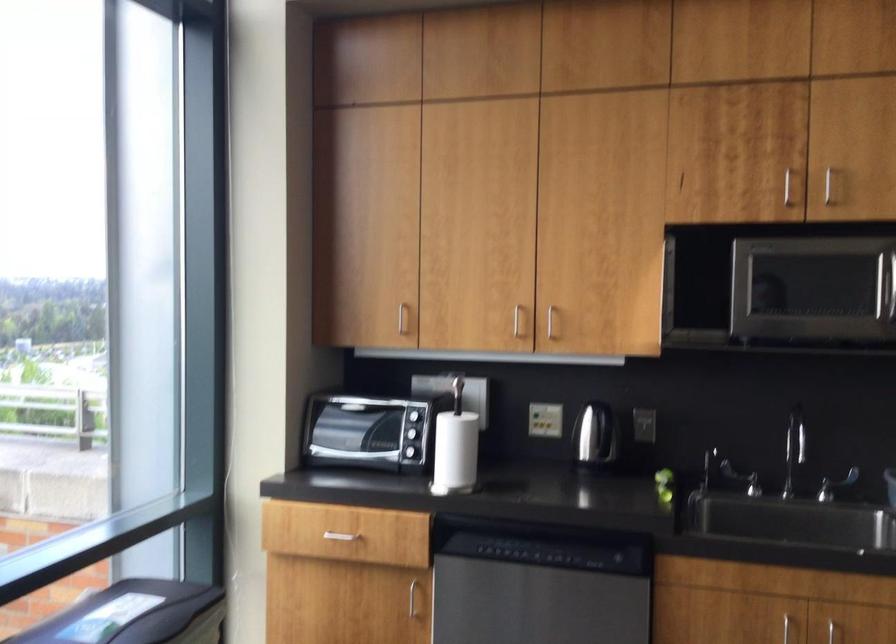
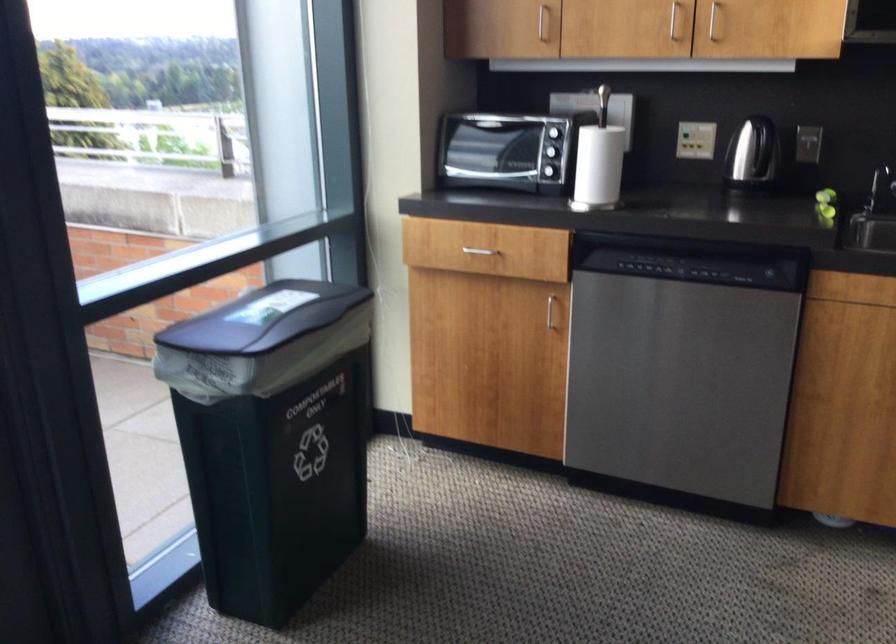
In the second image, find the point that corresponds to point 460,451 in the first image.

(599, 165)